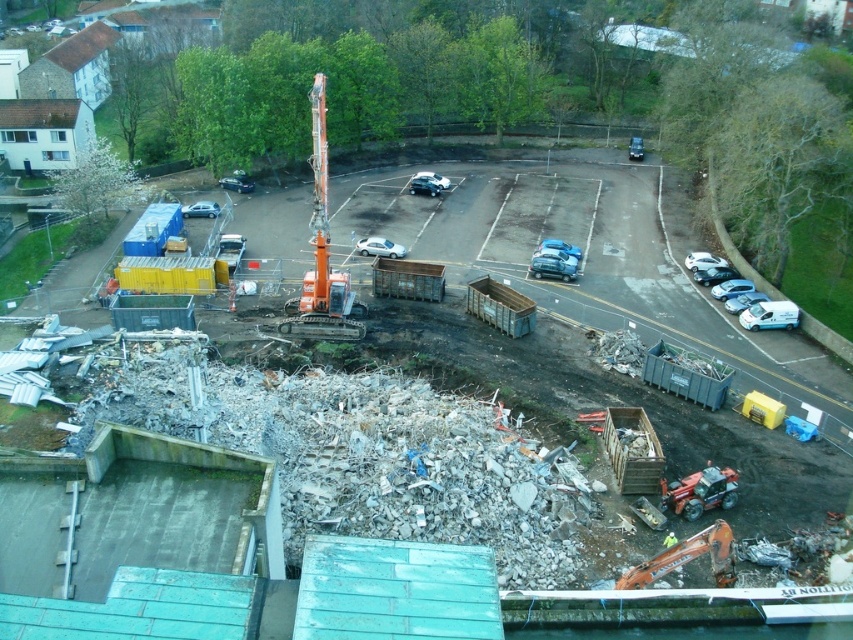
Which of these two, silver metallic car at center or metallic blue sedan at center, stands taller?

metallic blue sedan at center

Is point (189, 208) positioned after point (566, 252)?

That is True.

Locate an element on the screen. silver metallic car at center is located at coordinates (201, 209).

In the scene shown: Who is lower down, white matte car at center or metallic silver car at center?

white matte car at center

Find the location of a particular element. white matte car at center is located at coordinates (379, 248).

Does metallic blue sedan at center have a greater width compared to satin silver sedan at center?

Correct, the width of metallic blue sedan at center exceeds that of satin silver sedan at center.

Between metallic blue sedan at center and satin silver sedan at center, which one has less height?

metallic blue sedan at center

Who is more distant from viewer, (x=544, y=246) or (x=439, y=173)?

Point (x=439, y=173)

You are a GUI agent. You are given a task and a screenshot of the screen. Output one action in this format:
    pyautogui.click(x=<x>, y=<y>)
    Task: Click on the metallic blue sedan at center
    The width and height of the screenshot is (853, 640).
    Given the screenshot: What is the action you would take?
    pyautogui.click(x=560, y=248)